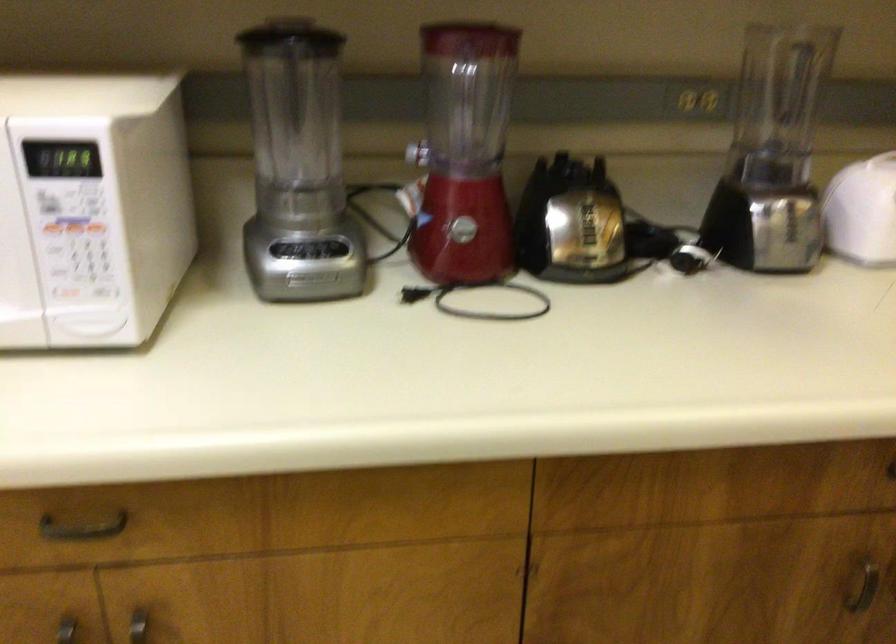
I want to click on blender button panel, so click(308, 249).